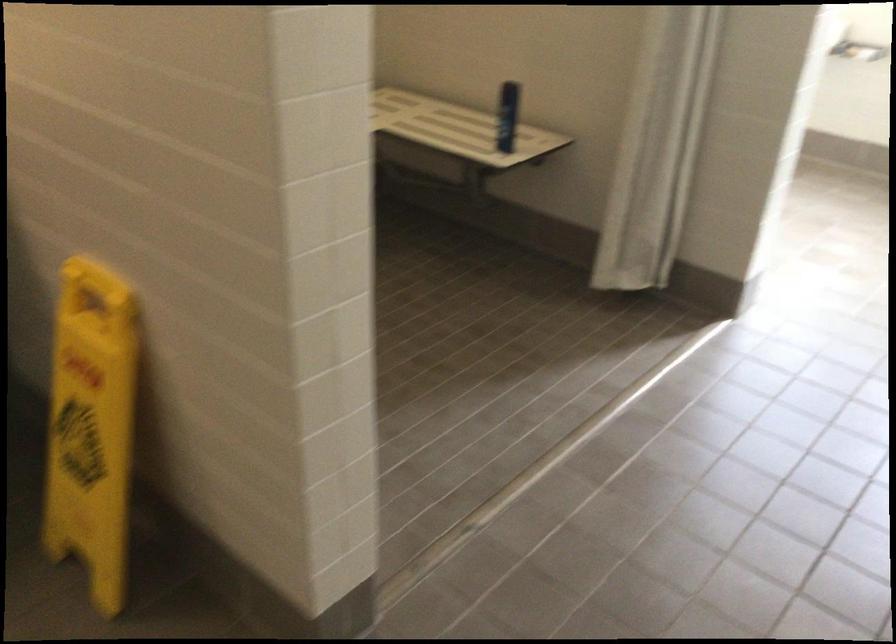
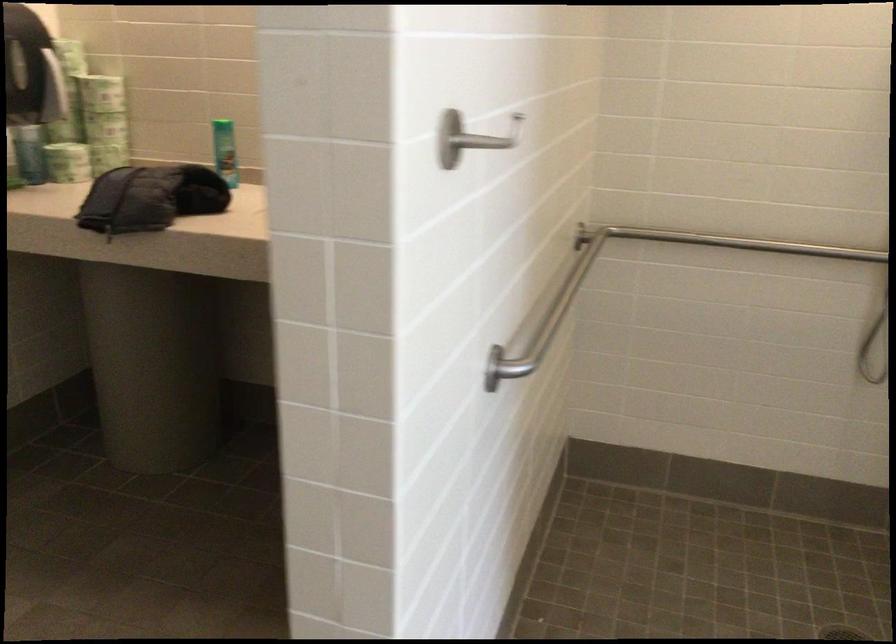
Question: The first image is from the beginning of the video and the second image is from the end. How did the camera likely rotate when shooting the video?

Choices:
 (A) Left
 (B) Right
 (C) Up
 (D) Down

Answer: (A)